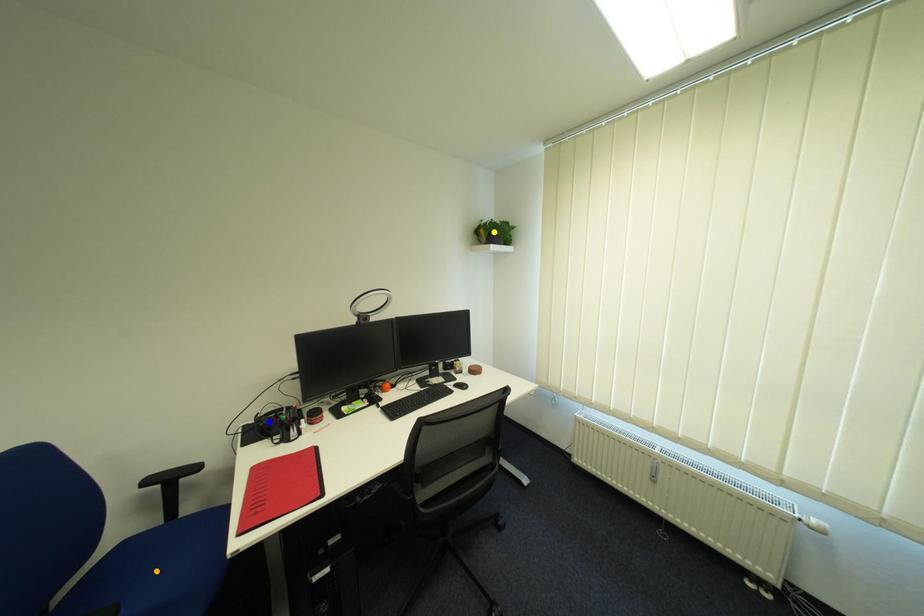
Order these from nearest to farthest:
yellow point | blue point | orange point

yellow point < blue point < orange point